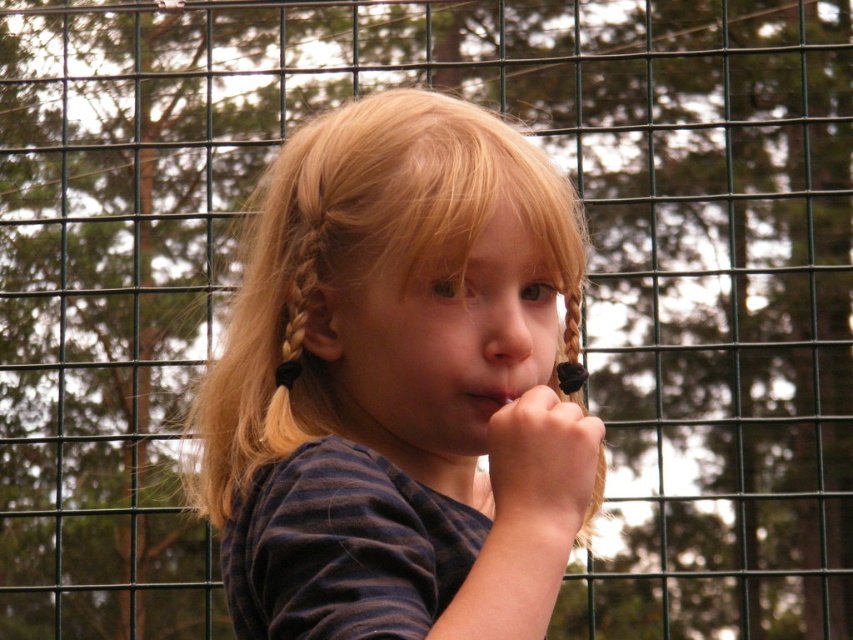
Question: Is blonde hair at center thinner than smooth skin hand at center?

Choices:
 (A) no
 (B) yes

Answer: (A)

Question: Considering the relative positions of blonde braided hair at center and matte pink lips at center in the image provided, where is blonde braided hair at center located with respect to matte pink lips at center?

Choices:
 (A) below
 (B) above

Answer: (A)

Question: Does blonde hair at center appear on the right side of blonde braided hair at center?

Choices:
 (A) no
 (B) yes

Answer: (A)

Question: Which object is farther from the camera taking this photo?

Choices:
 (A) blonde braided hair at center
 (B) matte pink lips at center
 (C) smooth skin hand at center

Answer: (B)

Question: Which object is closer to the camera taking this photo?

Choices:
 (A) smooth skin hand at center
 (B) matte pink lips at center

Answer: (A)

Question: Which point is closer to the camera?

Choices:
 (A) blonde hair at center
 (B) blonde braided hair at center
 (C) matte pink lips at center
 (D) smooth skin hand at center

Answer: (A)